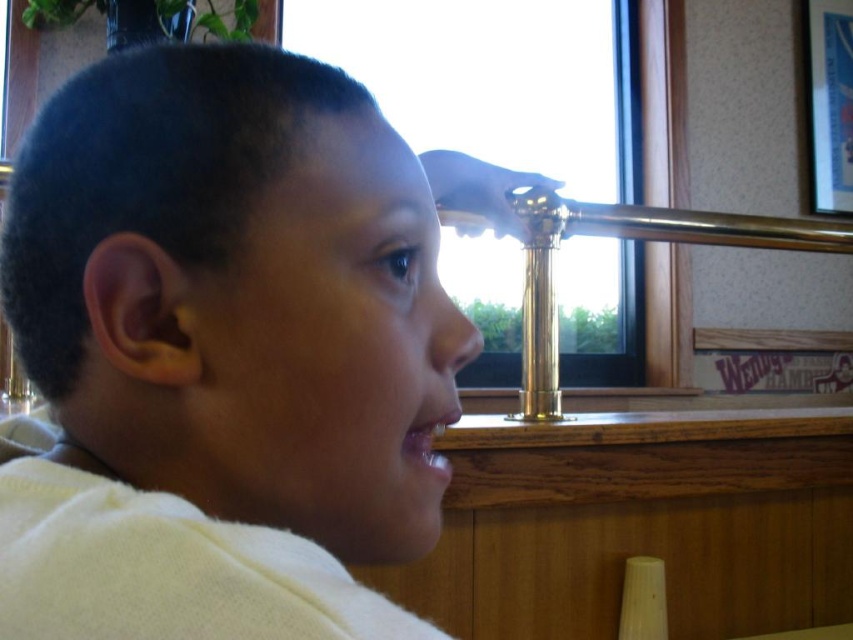
Can you confirm if white matte shirt at center is smaller than transparent glass window at center?

Yes.

Is point (119, 326) positioned before point (335, 61)?

Yes.

Image resolution: width=853 pixels, height=640 pixels. Identify the location of white matte shirt at center. (222, 353).